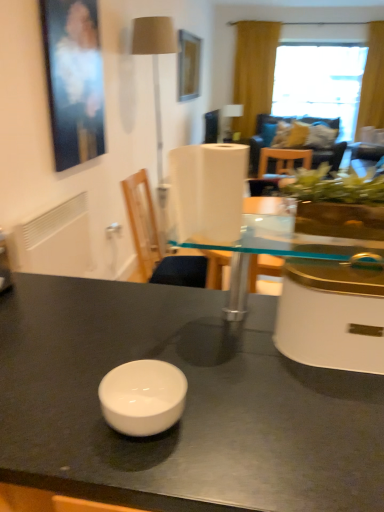
Identify the location of free spot in front of transparent glass table at center. The image size is (384, 512). (262, 397).